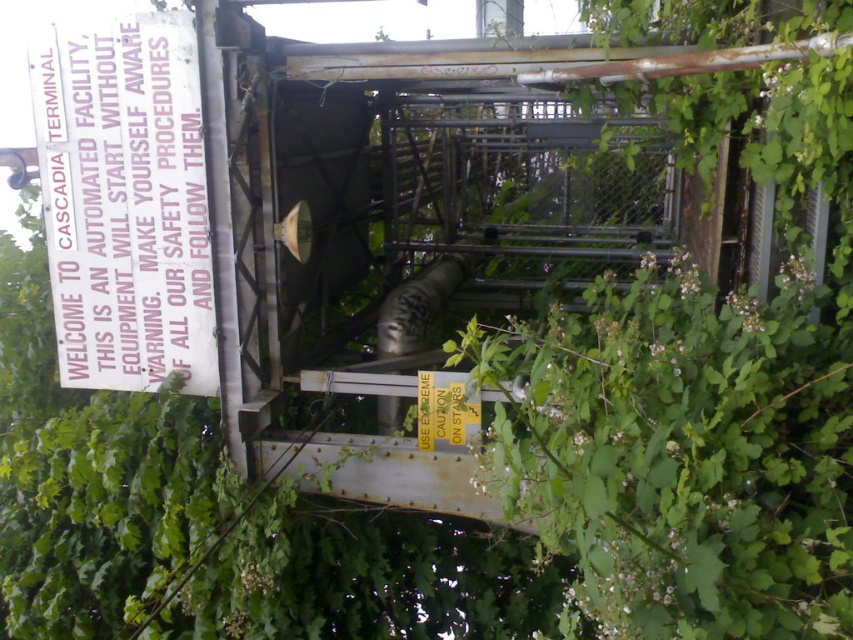
Question: Which point appears closest to the camera in this image?

Choices:
 (A) (462, 438)
 (B) (140, 193)

Answer: (A)

Question: Is the position of white paper sign at left more distant than that of yellow paper at center?

Choices:
 (A) yes
 (B) no

Answer: (B)

Question: Is white paper sign at left further to the viewer compared to yellow paper at center?

Choices:
 (A) no
 (B) yes

Answer: (A)

Question: Which point is closer to the camera?

Choices:
 (A) yellow paper at center
 (B) white paper sign at left

Answer: (B)

Question: Is white paper sign at left to the left of yellow paper at center from the viewer's perspective?

Choices:
 (A) yes
 (B) no

Answer: (A)